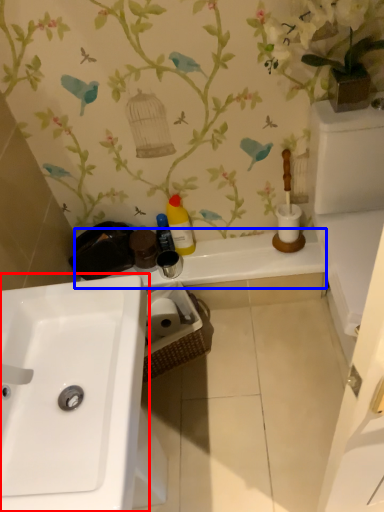
Question: Which of the following is the closest to the observer, sink (highlighted by a red box) or counter top (highlighted by a blue box)?

Choices:
 (A) sink
 (B) counter top

Answer: (A)